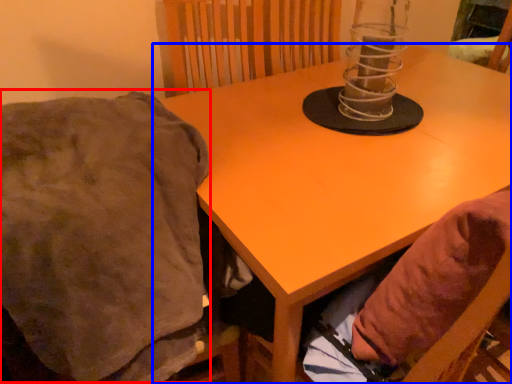
Question: Among these objects, which one is nearest to the camera, blanket (highlighted by a red box) or table (highlighted by a blue box)?

Choices:
 (A) blanket
 (B) table

Answer: (A)